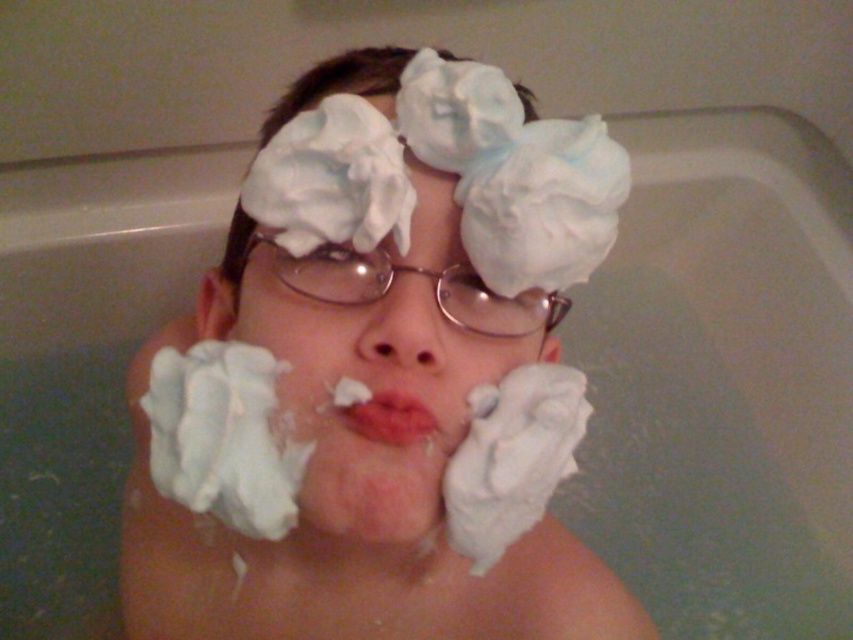
Question: Which point is closer to the camera taking this photo?

Choices:
 (A) (550, 461)
 (B) (233, 545)
 (C) (386, 316)

Answer: (C)

Question: Where is white foamy shaving cream at center located in relation to white fluffy tissue at center in the image?

Choices:
 (A) above
 (B) below

Answer: (B)

Question: Which point is closer to the camera?

Choices:
 (A) coord(196,486)
 (B) coord(190,541)

Answer: (A)

Question: Among these objects, which one is nearest to the camera?

Choices:
 (A) white fluffy tissue at center
 (B) white foamy shaving cream at center
 (C) white fluffy shaving cream at lower center

Answer: (A)

Question: Is matte white nose at center behind smooth pink lips at center?

Choices:
 (A) no
 (B) yes

Answer: (A)

Question: Does white foamy shaving cream at center appear on the left side of smooth pink lips at center?

Choices:
 (A) no
 (B) yes

Answer: (B)